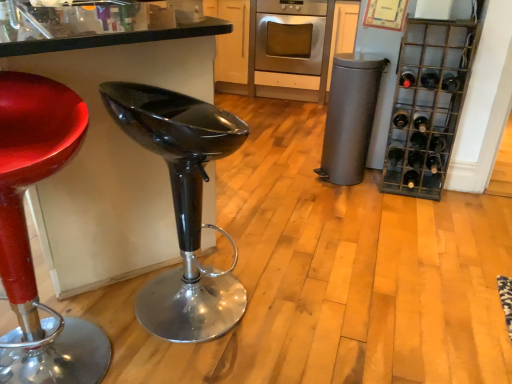
Where is `vacant area that lies between glossy black stool at center and shiny red stool at left`? The height and width of the screenshot is (384, 512). vacant area that lies between glossy black stool at center and shiny red stool at left is located at coordinates (119, 333).